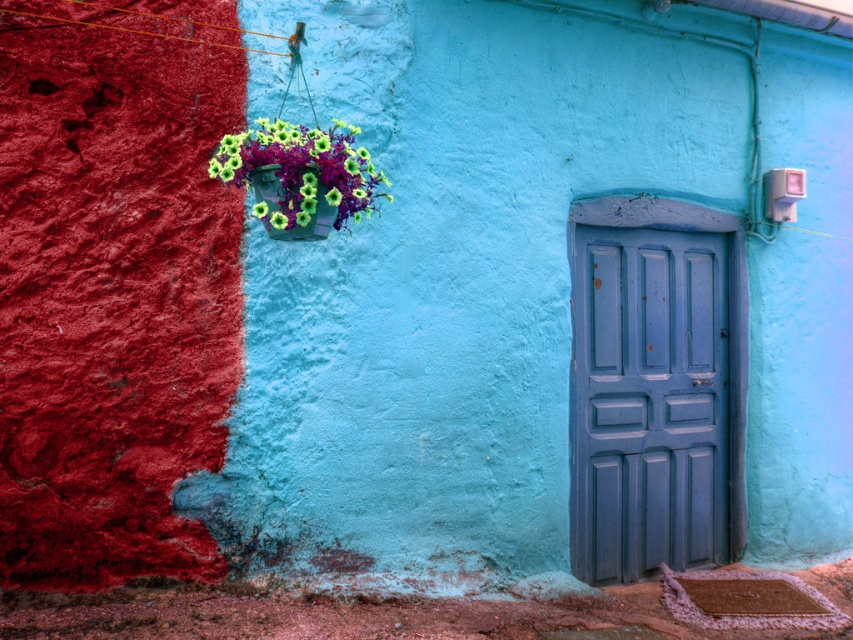
You are an interior designer assessing the wall with two colors. You need to place a new decorative item between the blue matte door at center and the matte plastic flowers at upper left. Which object is more appropriate to place closer to the door if the item must be smaller than both existing objects?

Since the blue matte door at center is larger than the matte plastic flowers at upper left, the decorative item should be placed closer to the matte plastic flowers at upper left to maintain size proportionality.

You are standing in front of the wall with the blue matte door at center and the matte plastic flowers at upper left. Which object is closer to you?

The blue matte door at center is closer to you because it is further to the viewer than the matte plastic flowers at upper left.

You are an interior designer planning to hang a new picture frame between the blue matte door at center and the matte plastic flowers at upper left. Based on their positions, where should you place the frame to ensure it is between them?

The blue matte door at center is located below the matte plastic flowers at upper left, so placing the picture frame between them would require positioning it above the door but below the flowers.